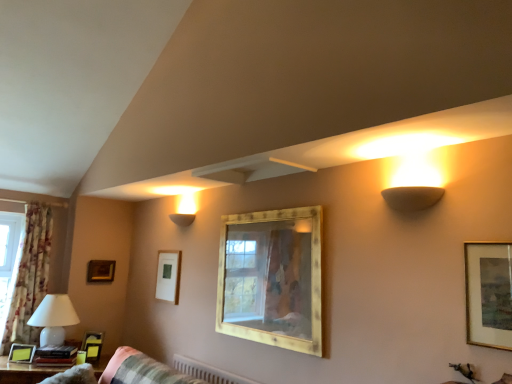
Question: Is the depth of wooden table at lower left less than that of wooden frame at upper left, the 1th picture frame in the back-to-front sequence?

Choices:
 (A) yes
 (B) no

Answer: (A)

Question: From a real-world perspective, is wooden table at lower left positioned under wooden frame at upper left, which is counted as the sixth picture frame, starting from the front, based on gravity?

Choices:
 (A) yes
 (B) no

Answer: (A)

Question: Considering the relative sizes of wooden table at lower left and wooden frame at upper left, the fifth picture frame when ordered from right to left, in the image provided, is wooden table at lower left wider than wooden frame at upper left, the fifth picture frame when ordered from right to left,?

Choices:
 (A) no
 (B) yes

Answer: (B)

Question: Are wooden table at lower left and wooden frame at upper left, which is the second picture frame from left to right, beside each other?

Choices:
 (A) no
 (B) yes

Answer: (A)

Question: From the image's perspective, is wooden table at lower left on wooden frame at upper left, the fifth picture frame when ordered from right to left?

Choices:
 (A) no
 (B) yes

Answer: (A)

Question: Is wooden frame at upper left, which is counted as the sixth picture frame, starting from the front, bigger or smaller than wooden table at lower left?

Choices:
 (A) small
 (B) big

Answer: (A)

Question: Is wooden frame at upper left, the fifth picture frame when ordered from right to left, situated inside wooden table at lower left or outside?

Choices:
 (A) outside
 (B) inside

Answer: (A)

Question: Is point (113, 274) positioned closer to the camera than point (25, 370)?

Choices:
 (A) closer
 (B) farther

Answer: (B)

Question: From a real-world perspective, relative to wooden table at lower left, is wooden frame at upper left, which is counted as the sixth picture frame, starting from the front, vertically above or below?

Choices:
 (A) above
 (B) below

Answer: (A)

Question: Is matte white picture frame at center-left, acting as the 5th picture frame starting from the front, situated inside matte yellow picture frame at lower left, the first picture frame viewed from the left, or outside?

Choices:
 (A) inside
 (B) outside

Answer: (B)

Question: Is matte white picture frame at center-left, acting as the 2th picture frame starting from the back, in front of or behind matte yellow picture frame at lower left, positioned as the third picture frame in front-to-back order, in the image?

Choices:
 (A) behind
 (B) front

Answer: (A)

Question: In terms of size, does matte white picture frame at center-left, which appears as the third picture frame when viewed from the right, appear bigger or smaller than matte yellow picture frame at lower left, positioned as the third picture frame in front-to-back order?

Choices:
 (A) small
 (B) big

Answer: (B)

Question: From the image's perspective, is matte white picture frame at center-left, acting as the 2th picture frame starting from the back, located above or below matte yellow picture frame at lower left, positioned as the third picture frame in front-to-back order?

Choices:
 (A) above
 (B) below

Answer: (A)

Question: Is matte yellow picture frame at lower left, marked as the sixth picture frame in a right-to-left arrangement, taller or shorter than wooden frame at upper left, the fifth picture frame when ordered from right to left?

Choices:
 (A) tall
 (B) short

Answer: (B)

Question: Is matte yellow picture frame at lower left, marked as the sixth picture frame in a right-to-left arrangement, in front of or behind wooden frame at upper left, which is the second picture frame from left to right, in the image?

Choices:
 (A) behind
 (B) front

Answer: (B)